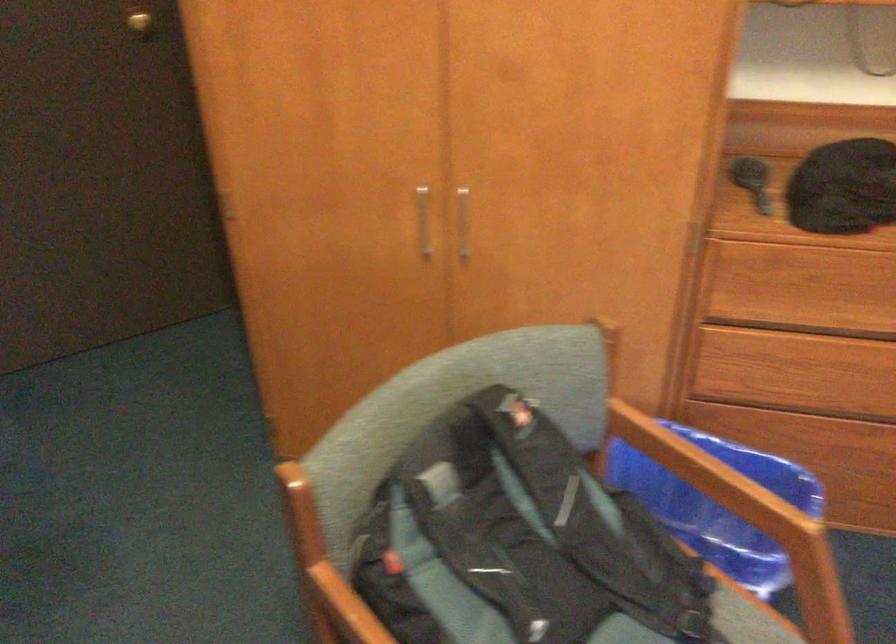
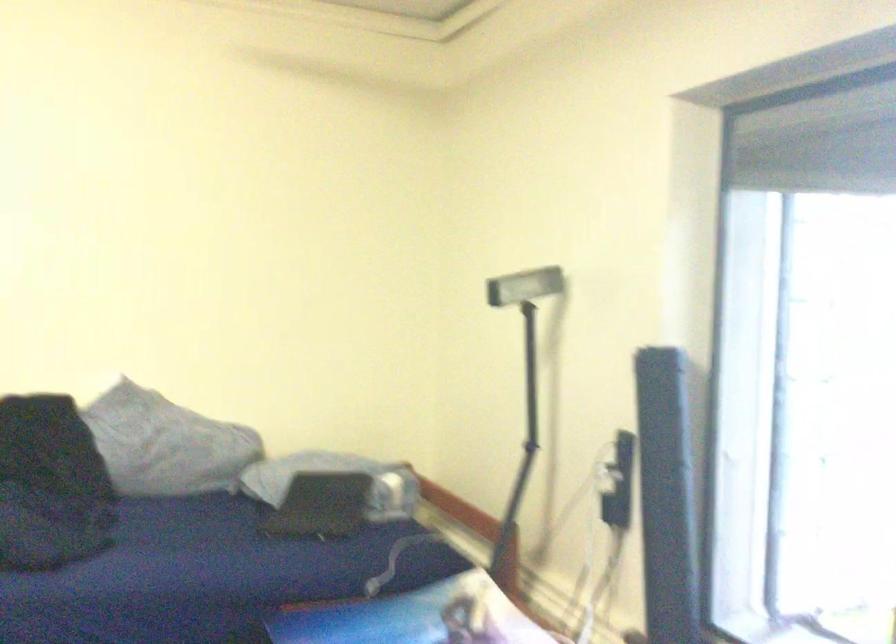
Question: The camera is either moving clockwise (left) or counter-clockwise (right) around the object. The first image is from the beginning of the video and the second image is from the end. Is the camera moving left or right when shooting the video?

Choices:
 (A) Left
 (B) Right

Answer: (A)